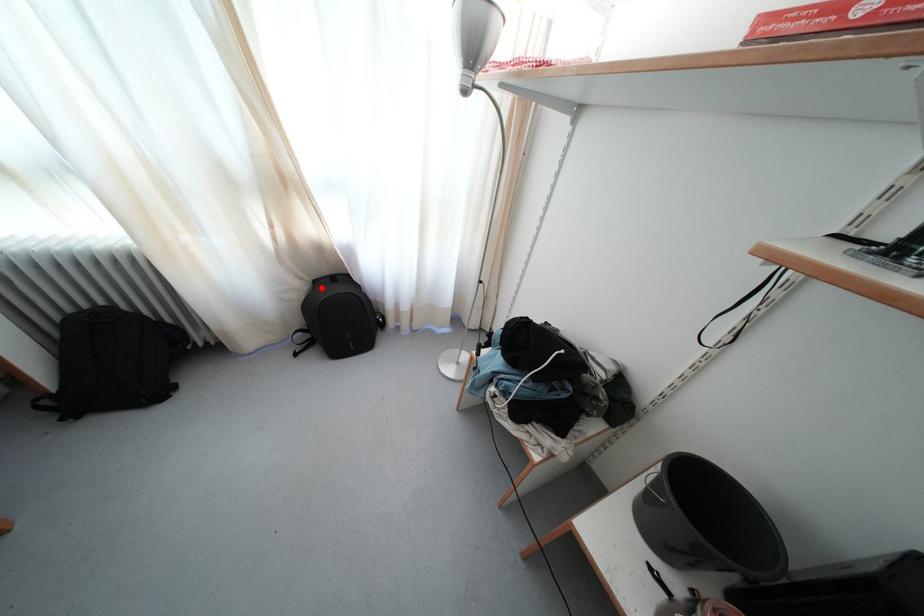
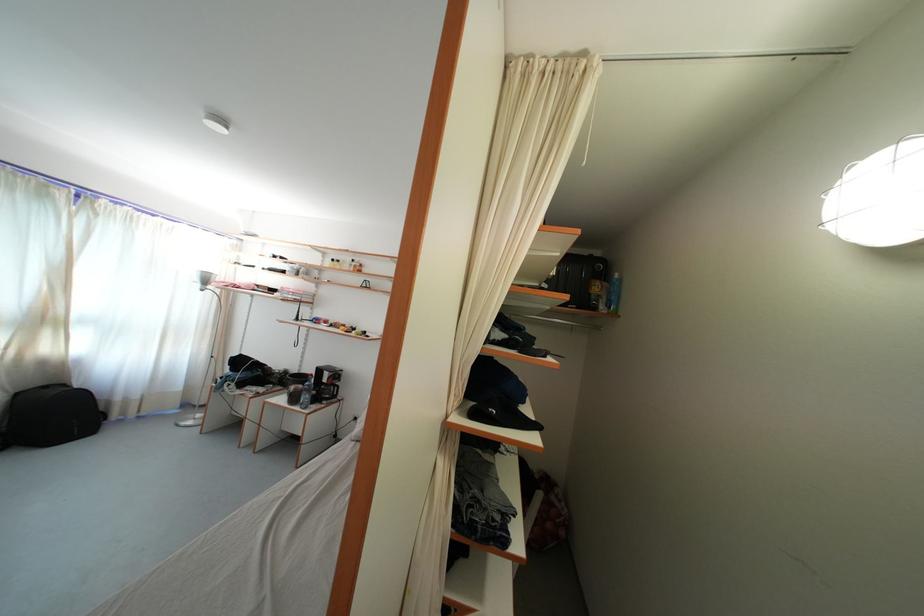
Question: I am providing you with two images of the same scene from different viewpoints. Image1 has a red point marked. In image2, the corresponding 3D location appears at what relative position? Reply with the corresponding letter.

Choices:
 (A) Closer
 (B) Farther

Answer: (B)